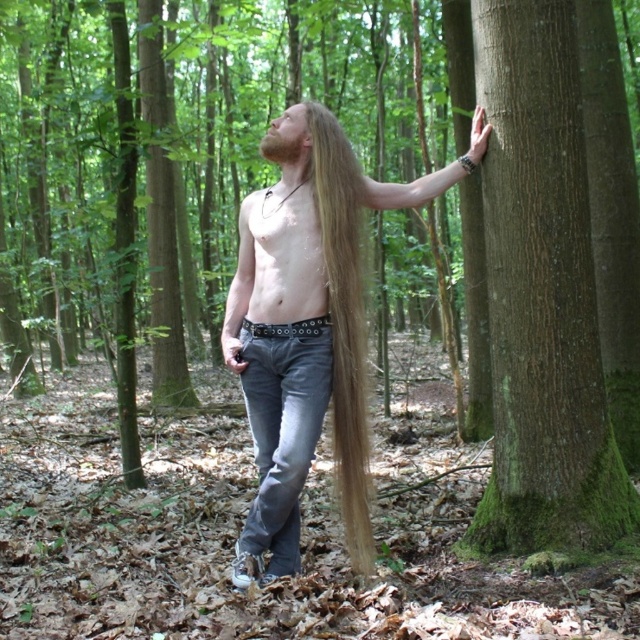
Question: Can you confirm if green mossy bark at right is positioned below leather glove at upper right?

Choices:
 (A) no
 (B) yes

Answer: (B)

Question: From the image, what is the correct spatial relationship of golden smooth hair at center in relation to matte black phone at lower center?

Choices:
 (A) left
 (B) right

Answer: (B)

Question: Does blonde hair at center lie behind golden smooth hair at center?

Choices:
 (A) no
 (B) yes

Answer: (A)

Question: Which is farther from the green mossy bark at right?

Choices:
 (A) leather glove at upper right
 (B) denim jeans at center
 (C) blonde hair at center

Answer: (B)

Question: Which object is farther from the camera taking this photo?

Choices:
 (A) denim jeans at center
 (B) brown fuzzy beard at upper center
 (C) blonde hair at center

Answer: (B)

Question: Which point is closer to the camera taking this photo?

Choices:
 (A) [x=342, y=445]
 (B) [x=276, y=566]
 (C) [x=532, y=276]

Answer: (C)